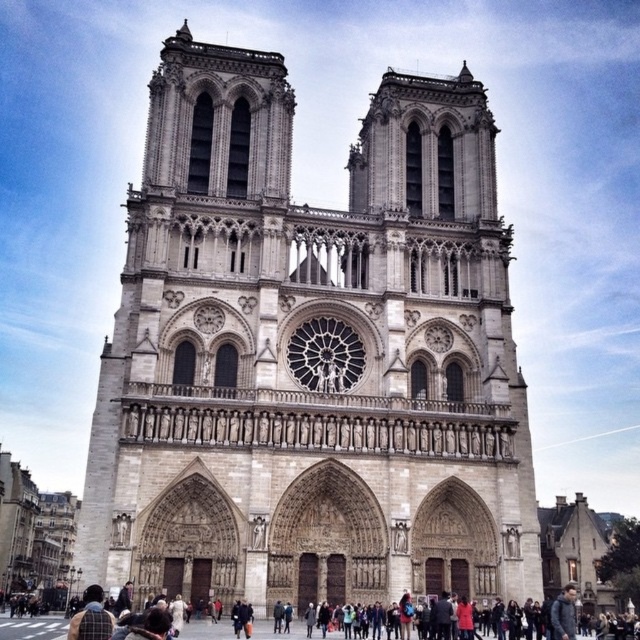
Can you confirm if stone cathedral at center is shorter than dark gray coat at lower center?

Incorrect, stone cathedral at center's height does not fall short of dark gray coat at lower center's.

From the picture: Is stone cathedral at center to the right of dark gray coat at lower center from the viewer's perspective?

No, stone cathedral at center is not to the right of dark gray coat at lower center.

In order to click on stone cathedral at center in this screenshot , I will do pos(310,353).

This screenshot has width=640, height=640. Find the location of `stone cathedral at center`. stone cathedral at center is located at coordinates (310, 353).